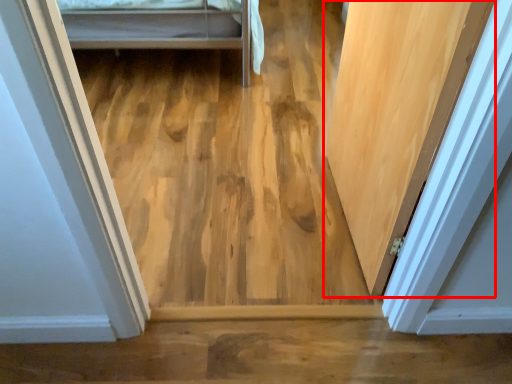
Question: Where is door (annotated by the red box) located in relation to plywood in the image?

Choices:
 (A) right
 (B) left

Answer: (A)